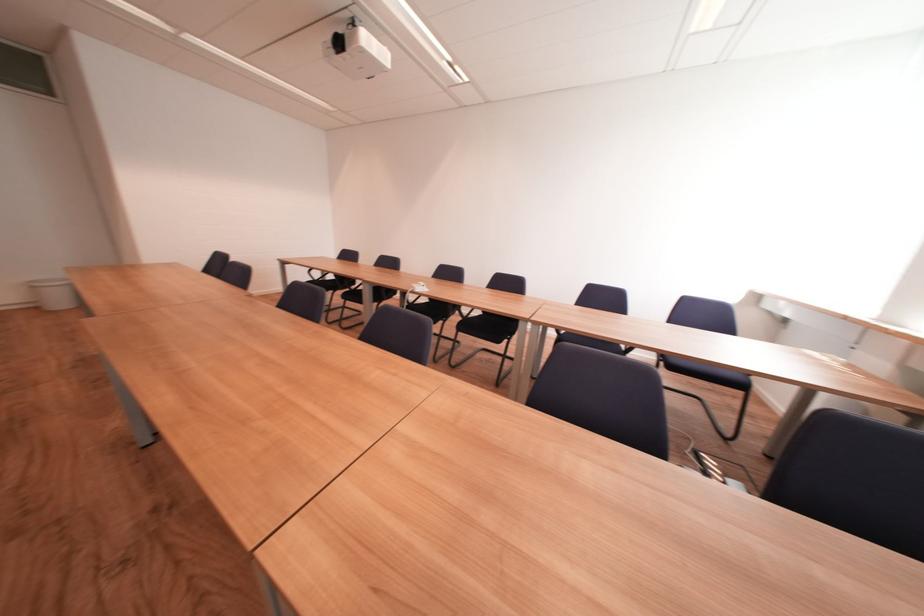
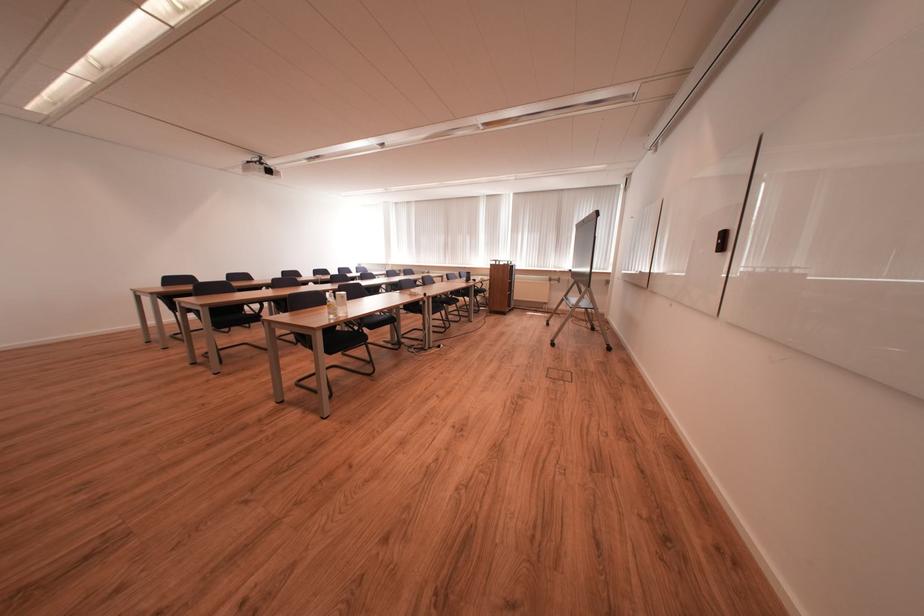
Where in the second image is the point corresponding to point (348, 46) from the first image?

(277, 174)